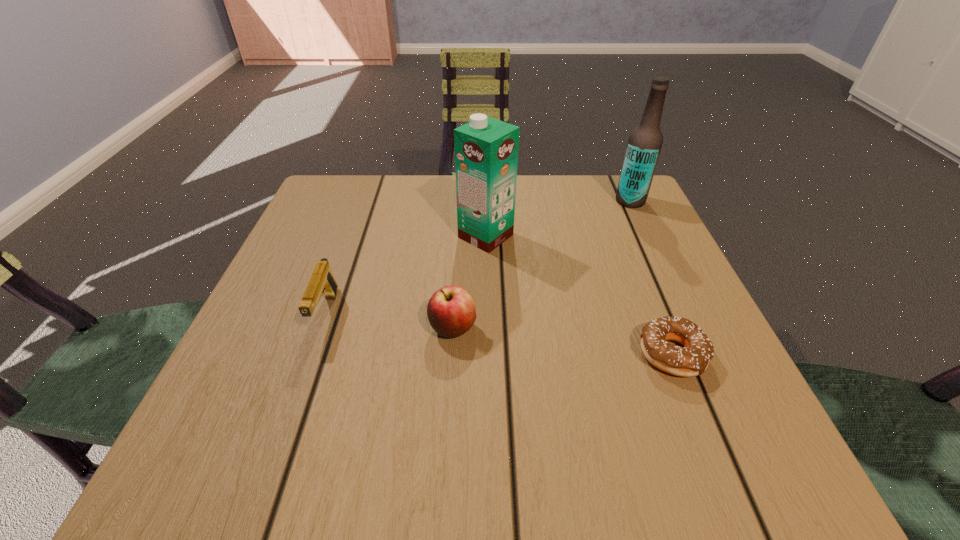
This screenshot has height=540, width=960. Find the location of `beer bottle`. beer bottle is located at coordinates (644, 145).

Where is `carton`? carton is located at coordinates (486, 150).

At what (x,y) coordinates should I click in order to perform the action: click on apple. Please return your answer as a coordinate pair (x, y). Looking at the image, I should click on (451, 311).

You are a GUI agent. You are given a task and a screenshot of the screen. Output one action in this format:
    pyautogui.click(x=<x>, y=<y>)
    Task: Click on the leftmost object
    
    Given the screenshot: What is the action you would take?
    pyautogui.click(x=322, y=282)

Identify the location of doughnut. Image resolution: width=960 pixels, height=540 pixels. (691, 360).

Locate an element on the screen. Image resolution: width=960 pixels, height=540 pixels. free spot located on the side of the farthest object with the label is located at coordinates (543, 201).

Identify the location of free space located 0.300m on the side of the farthest object with the label. The width and height of the screenshot is (960, 540). (489, 201).

The height and width of the screenshot is (540, 960). In order to click on vacant space situated on the side of the farthest object with the label in this screenshot , I will do `click(481, 201)`.

Where is `blank area located on the back of the carton`? This screenshot has height=540, width=960. blank area located on the back of the carton is located at coordinates (485, 192).

Image resolution: width=960 pixels, height=540 pixels. Find the location of `vacant space located on the front of the apple`. vacant space located on the front of the apple is located at coordinates (445, 452).